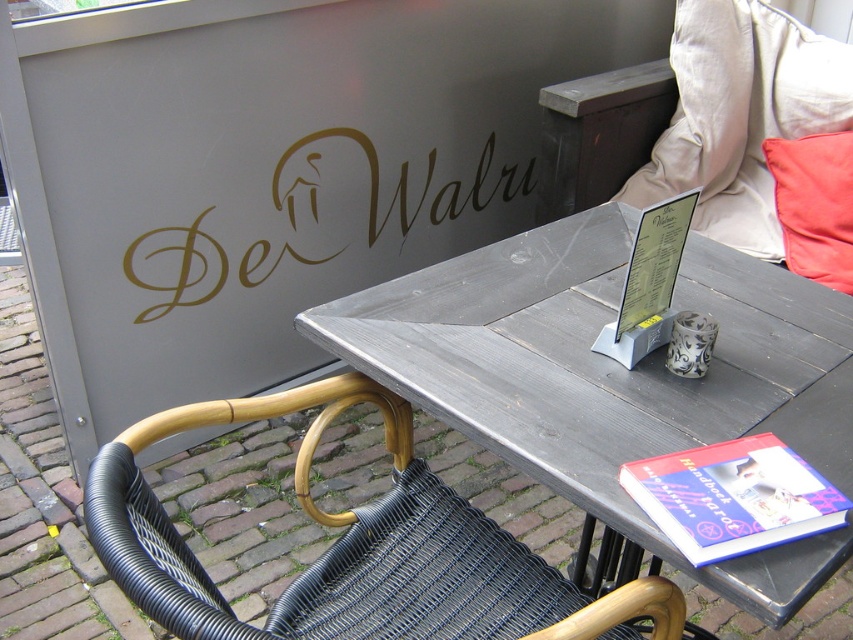
You are a customer at De Walri and want to place your handbag on the dark gray wood table at center. However, you notice the red fabric pillow at upper right is also on the table. Can the handbag fit on the table without overlapping the pillow?

The dark gray wood table at center might be wider than red fabric pillow at upper right, so there is a possibility that the handbag can fit without overlapping the pillow, but it depends on the exact dimensions of both items.

In the scene shown: You are a customer sitting in the wicker chair off to the left and want to place your drink on the nearest surface. The dark gray wood table at center and the red fabric pillow at upper right are both visible. Which surface is closer to you?

The dark gray wood table at center is closer to you because it is located below the red fabric pillow at upper right, meaning it is positioned lower and nearer in the seating area.

You are designing a layout for a new menu board and need to place both the gold metallic sign at upper center and the blue hardcover book at lower right. Given their sizes, which object should be placed first to ensure proper visibility?

The gold metallic sign at upper center should be placed first because it is larger than the blue hardcover book at lower right, ensuring it can be easily seen without being obstructed by the smaller object.